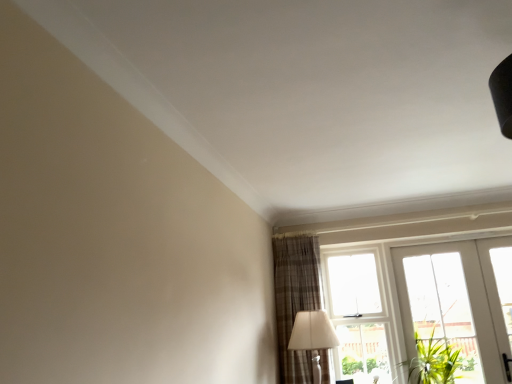
Question: Based on their sizes in the image, would you say transparent glass window at upper right is bigger or smaller than white fabric lampshade at lower right?

Choices:
 (A) small
 (B) big

Answer: (A)

Question: Considering the positions of transparent glass window at upper right and white fabric lampshade at lower right in the image, is transparent glass window at upper right taller or shorter than white fabric lampshade at lower right?

Choices:
 (A) tall
 (B) short

Answer: (A)

Question: Considering the real-world distances, which object is closest to the plaid fabric curtain at lower right?

Choices:
 (A) transparent glass window at upper right
 (B) white glossy door at lower right
 (C) white fabric lampshade at lower right

Answer: (C)

Question: Estimate the real-world distances between objects in this image. Which object is farther from the transparent glass window at upper right?

Choices:
 (A) plaid fabric curtain at lower right
 (B) white glossy door at lower right
 (C) white fabric lampshade at lower right

Answer: (C)